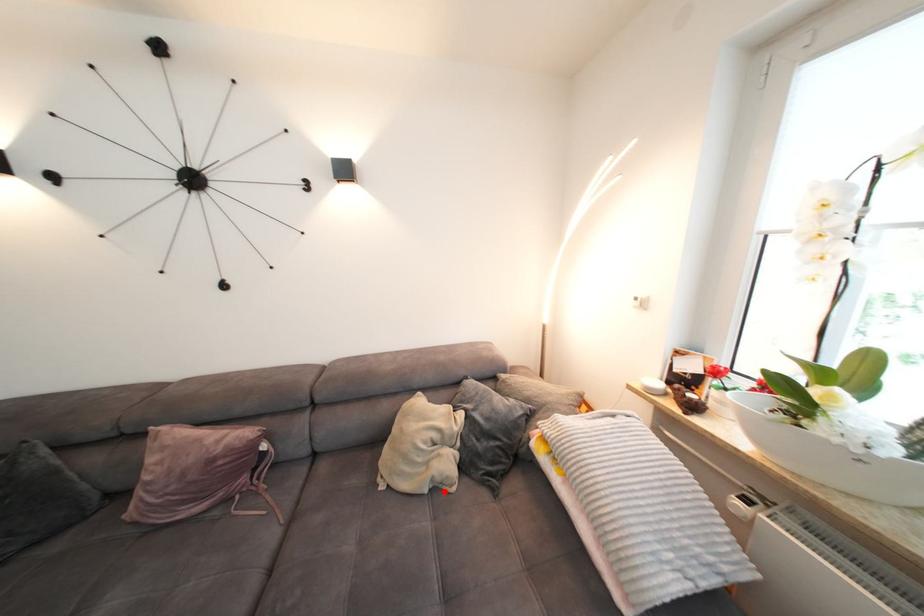
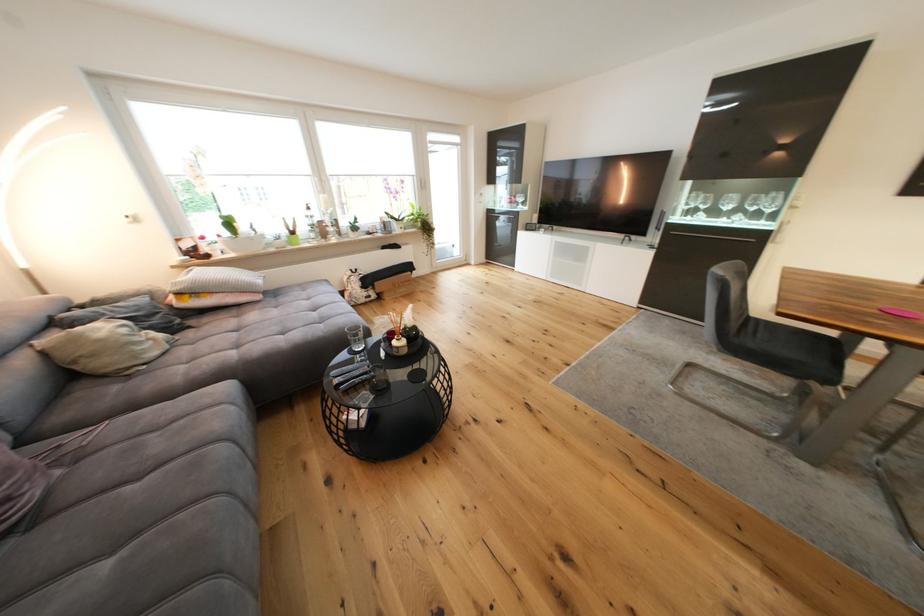
Question: I am providing you with two images of the same scene from different viewpoints. Image1 has a red point marked. In image2, the corresponding 3D location appears at what relative position? Reply with the corresponding letter.

Choices:
 (A) Closer
 (B) Farther

Answer: (A)